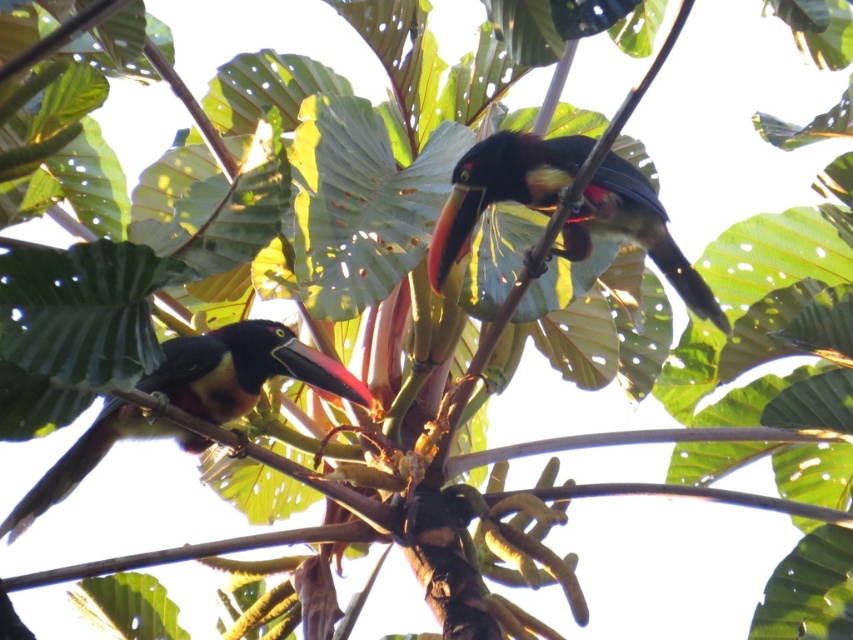
Can you confirm if shiny black toucan at center is positioned above shiny black toucan at left?

Correct, shiny black toucan at center is located above shiny black toucan at left.

Is shiny black toucan at center shorter than shiny black toucan at left?

Indeed, shiny black toucan at center has a lesser height compared to shiny black toucan at left.

Measure the distance between shiny black toucan at center and camera.

shiny black toucan at center and camera are 2.49 meters apart from each other.

At what (x,y) coordinates should I click in order to perform the action: click on shiny black toucan at center. Please return your answer as a coordinate pair (x, y). The image size is (853, 640). Looking at the image, I should click on (502, 188).